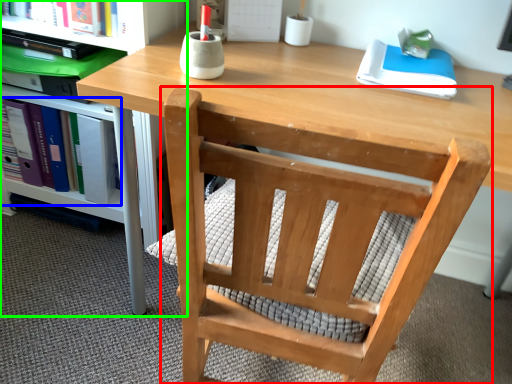
Question: Which object is positioned closest to chair (highlighted by a red box)? Select from book (highlighted by a blue box) and shelf (highlighted by a green box).

Choices:
 (A) book
 (B) shelf

Answer: (B)